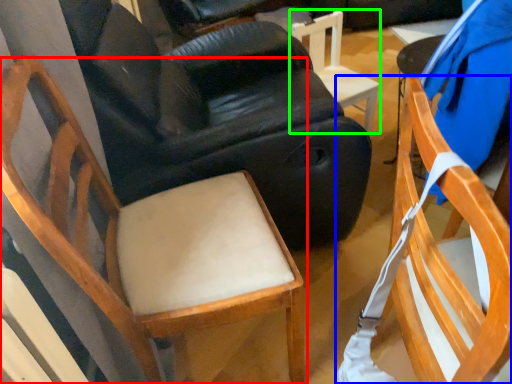
Question: Which is nearer to the chair (highlighted by a red box)? chair (highlighted by a blue box) or chair (highlighted by a green box).

Choices:
 (A) chair
 (B) chair

Answer: (A)